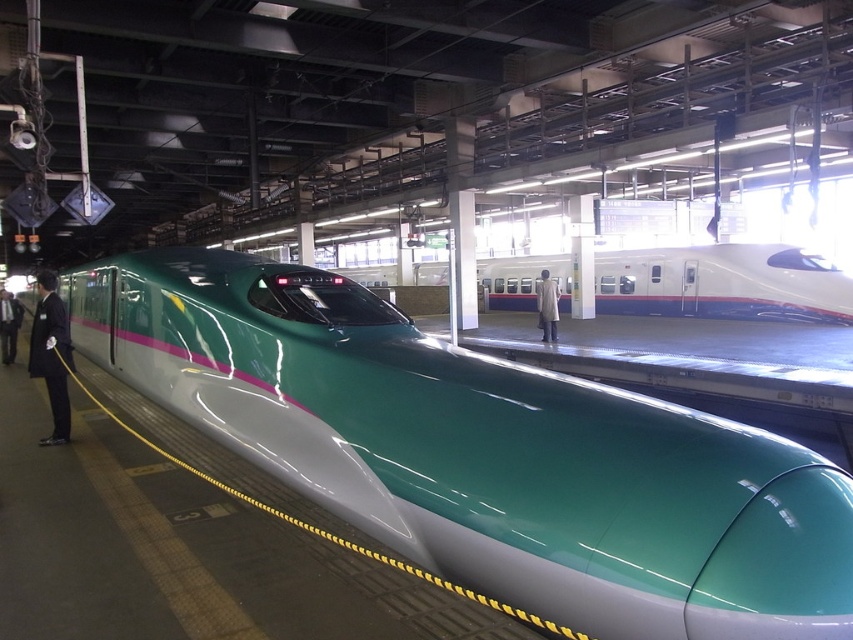
Looking at this image, between teal glossy train at center and light gray coat at center, which one is positioned higher?

Positioned higher is teal glossy train at center.

Where is `teal glossy train at center`? This screenshot has width=853, height=640. teal glossy train at center is located at coordinates (723, 284).

What do you see at coordinates (723, 284) in the screenshot? Image resolution: width=853 pixels, height=640 pixels. I see `teal glossy train at center` at bounding box center [723, 284].

I want to click on teal glossy train at center, so click(723, 284).

Is teal glossy train at center further to the viewer compared to dark suit at left?

Yes.

Which is above, teal glossy train at center or dark suit at left?

teal glossy train at center is higher up.

This screenshot has height=640, width=853. What are the coordinates of `teal glossy train at center` in the screenshot? It's located at (723, 284).

Is the position of teal glossy train at center more distant than that of black suit at left?

Yes, teal glossy train at center is behind black suit at left.

Does teal glossy train at center have a lesser height compared to black suit at left?

Correct, teal glossy train at center is not as tall as black suit at left.

Does point (752, 243) come behind point (32, 355)?

Yes, it is.

Locate an element on the screen. The height and width of the screenshot is (640, 853). teal glossy train at center is located at coordinates (723, 284).